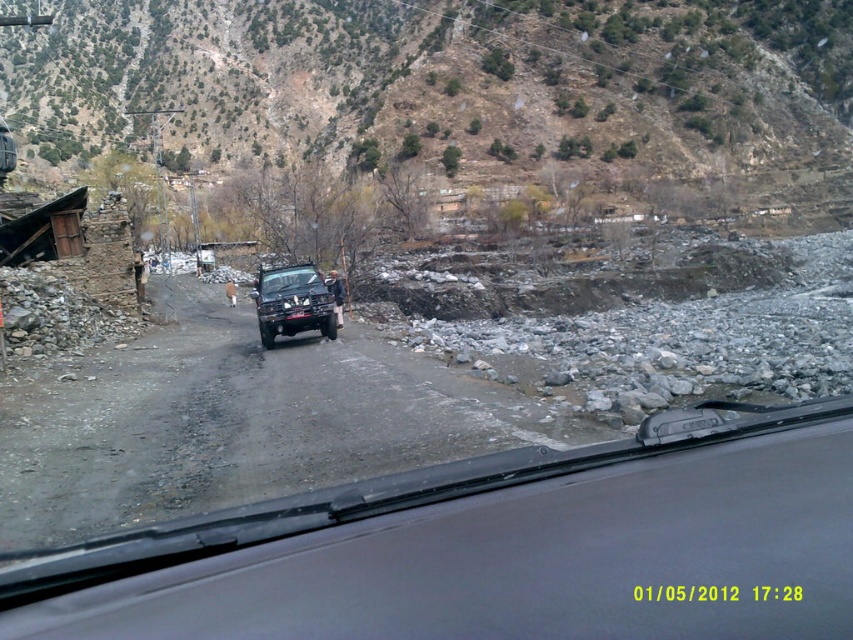
Is brown rocky hillside at upper center above shiny black jeep at center?

Yes.

Can you confirm if brown rocky hillside at upper center is positioned below shiny black jeep at center?

No.

Image resolution: width=853 pixels, height=640 pixels. What do you see at coordinates (448, 83) in the screenshot? I see `brown rocky hillside at upper center` at bounding box center [448, 83].

Locate an element on the screen. brown rocky hillside at upper center is located at coordinates (448, 83).

The height and width of the screenshot is (640, 853). What do you see at coordinates (496, 547) in the screenshot?
I see `black rubber windshield at center` at bounding box center [496, 547].

Between black rubber windshield at center and brown rocky hillside at upper center, which one has more height?

Standing taller between the two is brown rocky hillside at upper center.

Is point (689, 620) positioned in front of point (125, 4)?

Yes.

Where is `black rubber windshield at center`? black rubber windshield at center is located at coordinates 496,547.

Is black rubber windshield at center to the left of shiny black jeep at center from the viewer's perspective?

In fact, black rubber windshield at center is to the right of shiny black jeep at center.

Is black rubber windshield at center wider than shiny black jeep at center?

Yes.

Between point (676, 596) and point (328, 337), which one is positioned in front?

Point (676, 596) is in front.

Identify the location of black rubber windshield at center. (496, 547).